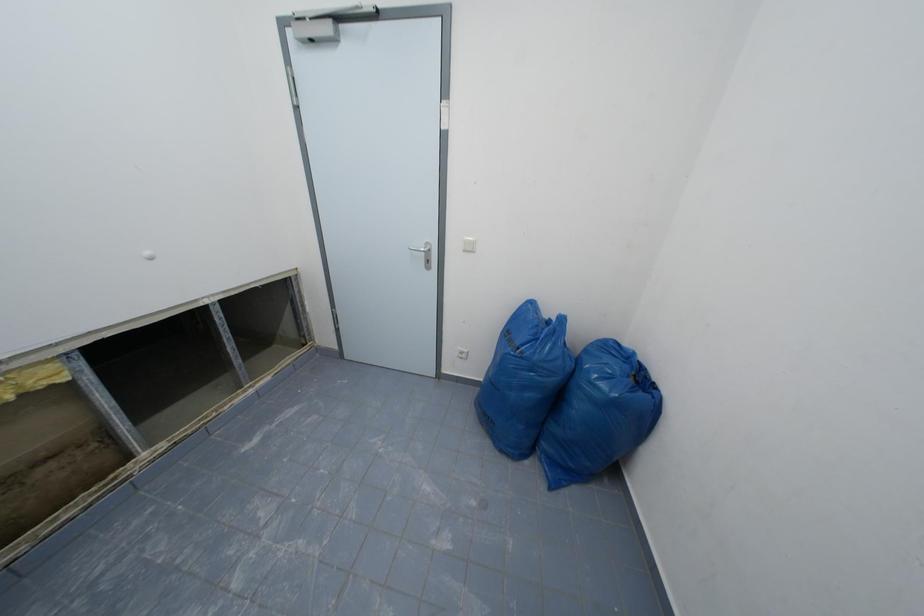
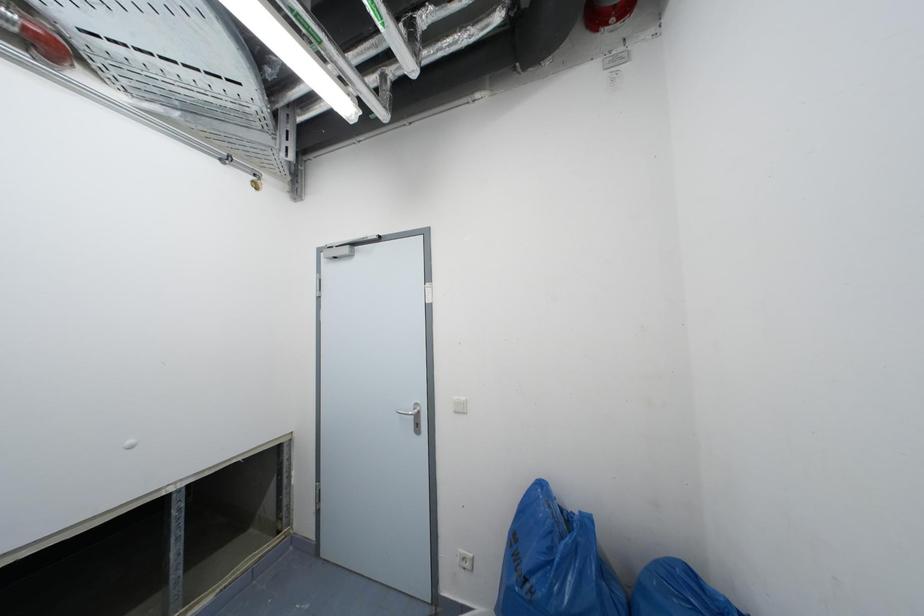
Question: The first image is from the beginning of the video and the second image is from the end. How did the camera likely rotate when shooting the video?

Choices:
 (A) Left
 (B) Right
 (C) Up
 (D) Down

Answer: (C)